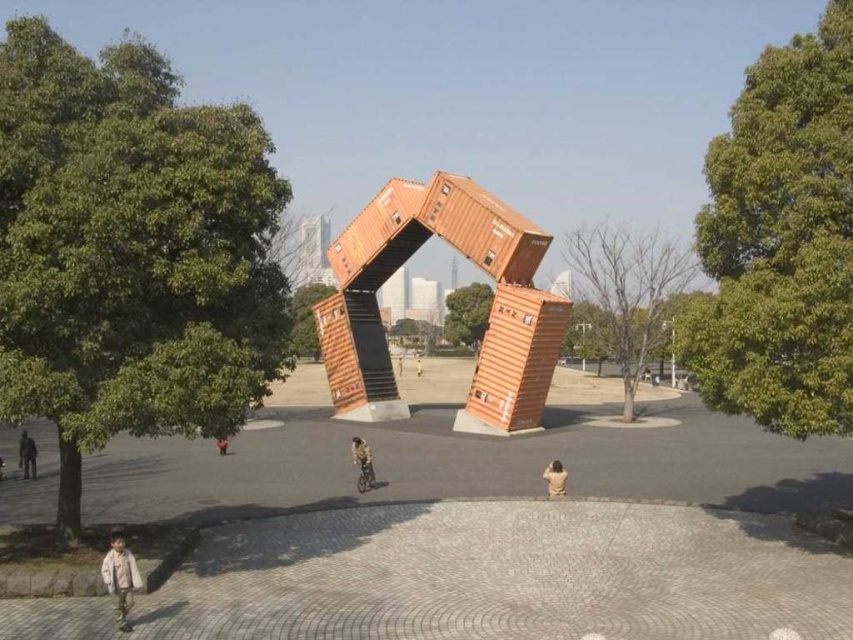
Can you confirm if yellow fabric jacket at center is positioned to the left of light brown wooden bench at center?

Incorrect, yellow fabric jacket at center is not on the left side of light brown wooden bench at center.

Who is more forward, (354, 454) or (398, 374)?

Point (354, 454) is in front.

Is point (360, 445) behind point (399, 371)?

No, (360, 445) is in front of (399, 371).

Where is `yellow fabric jacket at center`? This screenshot has height=640, width=853. yellow fabric jacket at center is located at coordinates (363, 464).

Is point (666, 339) farther from camera compared to point (358, 465)?

Yes.

Based on the photo, which is more to the left, bare wood tree at center or yellow fabric jacket at center?

From the viewer's perspective, yellow fabric jacket at center appears more on the left side.

Is point (608, 317) positioned after point (364, 449)?

Yes.

Locate an element on the screen. This screenshot has height=640, width=853. bare wood tree at center is located at coordinates (625, 296).

Can you confirm if green leafy tree at upper right is positioned to the right of dark brown leather jacket at lower left?

Correct, you'll find green leafy tree at upper right to the right of dark brown leather jacket at lower left.

Who is more distant from viewer, (724,284) or (33,444)?

Point (33,444)

Who is more forward, [735,408] or [26,456]?

Positioned in front is point [735,408].

Locate an element on the screen. Image resolution: width=853 pixels, height=640 pixels. green leafy tree at upper right is located at coordinates (780, 241).